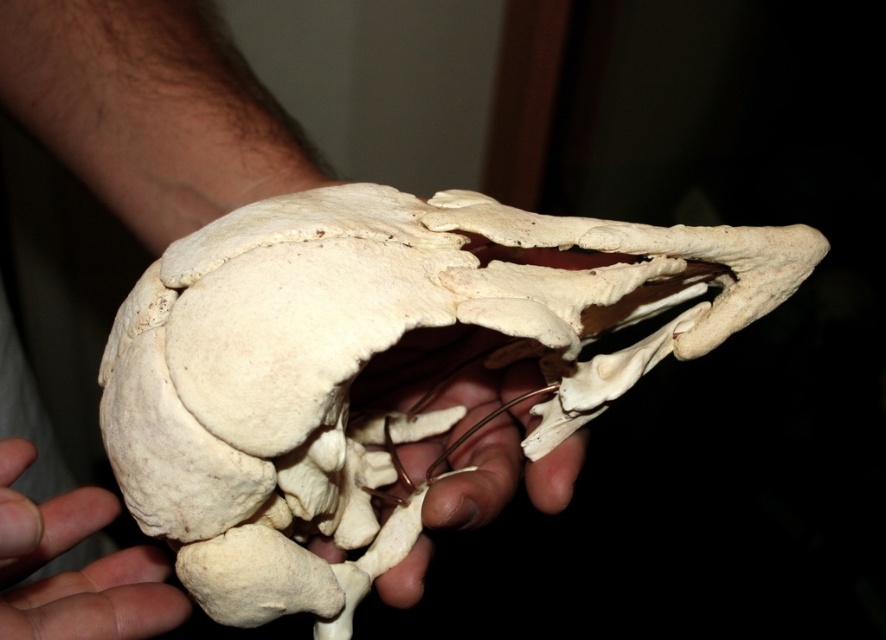
Question: Which of the following is the closest to the observer?

Choices:
 (A) white bone skull at center
 (B) white matte skull at center

Answer: (B)

Question: Which point is closer to the camera?

Choices:
 (A) (131, 424)
 (B) (470, 461)
 (C) (107, 618)

Answer: (A)

Question: Does white bone skull at center have a lesser width compared to white matte skull at center?

Choices:
 (A) no
 (B) yes

Answer: (A)

Question: Is white matte bone at center positioned behind white matte skull at center?

Choices:
 (A) yes
 (B) no

Answer: (A)

Question: Estimate the real-world distances between objects in this image. Which object is farther from the white bone skull at center?

Choices:
 (A) white matte skull at center
 (B) white matte bone at center

Answer: (A)

Question: Can you confirm if white matte bone at center is positioned below white matte skull at center?

Choices:
 (A) no
 (B) yes

Answer: (A)